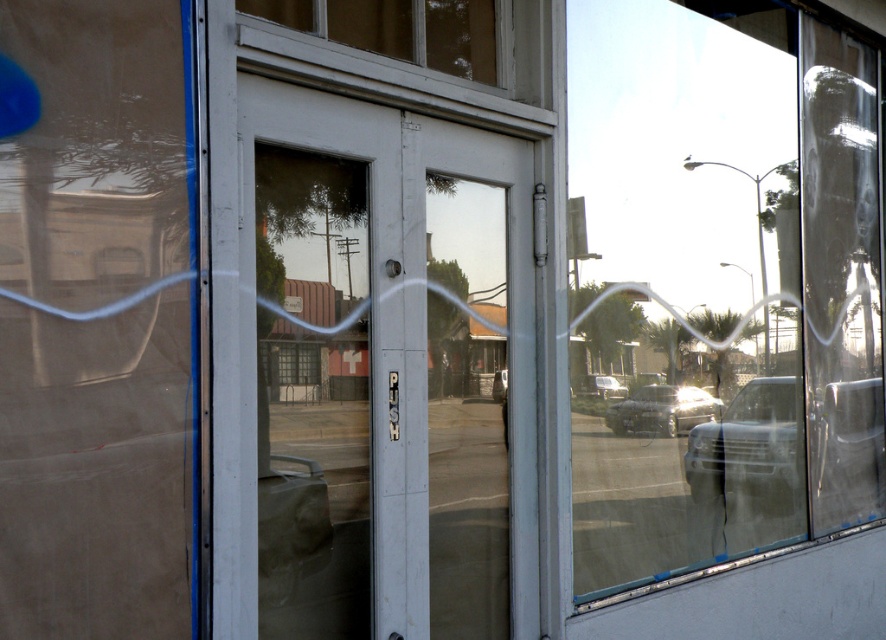
Is point (806, 200) closer to viewer compared to point (622, 387)?

No.

Looking at this image, is transparent glass door at center taller than silver metallic car at center?

Yes, transparent glass door at center is taller than silver metallic car at center.

Does point (809, 209) lie in front of point (600, 384)?

No, it is behind (600, 384).

The image size is (886, 640). Identify the location of transparent glass door at center. [x=721, y=282].

Is white glossy door at center to the right of metallic silver sedan at center from the viewer's perspective?

In fact, white glossy door at center is to the left of metallic silver sedan at center.

Does white glossy door at center have a lesser height compared to metallic silver sedan at center?

No, white glossy door at center is not shorter than metallic silver sedan at center.

Describe the element at coordinates (387, 369) in the screenshot. The height and width of the screenshot is (640, 886). I see `white glossy door at center` at that location.

At what (x,y) coordinates should I click in order to perform the action: click on white glossy door at center. Please return your answer as a coordinate pair (x, y). This screenshot has height=640, width=886. Looking at the image, I should click on (387, 369).

Between transparent glass door at center and metallic silver sedan at center, which one appears on the right side from the viewer's perspective?

From the viewer's perspective, transparent glass door at center appears more on the right side.

Who is shorter, transparent glass door at center or metallic silver sedan at center?

metallic silver sedan at center is shorter.

Find the location of a particular element. The image size is (886, 640). transparent glass door at center is located at coordinates (721, 282).